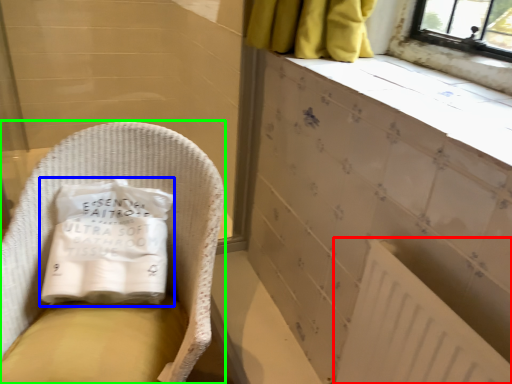
Question: Which object is positioned farthest from radiator (highlighted by a red box)? Select from material (highlighted by a blue box) and furniture (highlighted by a green box).

Choices:
 (A) material
 (B) furniture

Answer: (A)